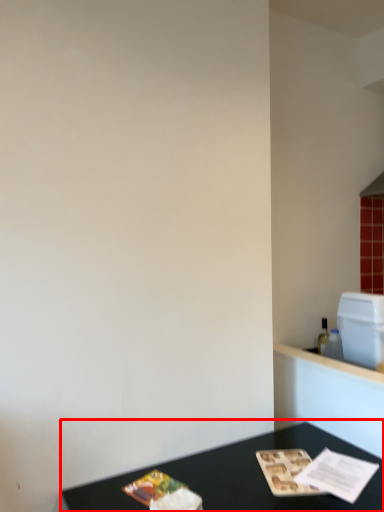
Question: From the image's perspective, what is the correct spatial relationship of table (annotated by the red box) in relation to appliance?

Choices:
 (A) below
 (B) above

Answer: (A)